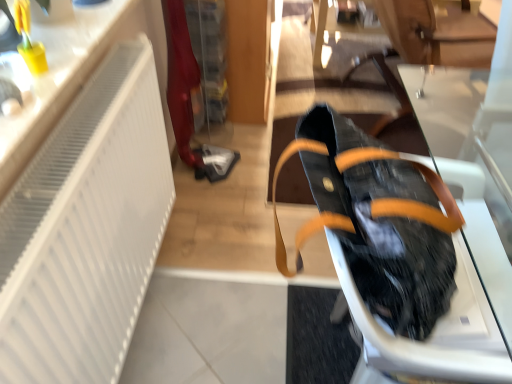
Question: Considering their positions, is black leather bag at right located in front of or behind white matte radiator at left?

Choices:
 (A) behind
 (B) front

Answer: (A)

Question: Would you say black leather bag at right is to the left or to the right of white matte radiator at left in the picture?

Choices:
 (A) right
 (B) left

Answer: (A)

Question: From their relative heights in the image, would you say black leather bag at right is taller or shorter than white matte radiator at left?

Choices:
 (A) tall
 (B) short

Answer: (B)

Question: Considering the positions of white matte radiator at left and black leather bag at right in the image, is white matte radiator at left wider or thinner than black leather bag at right?

Choices:
 (A) thin
 (B) wide

Answer: (A)

Question: From the image's perspective, relative to black leather bag at right, is white matte radiator at left above or below?

Choices:
 (A) above
 (B) below

Answer: (B)

Question: Considering the positions of white matte radiator at left and black leather bag at right in the image, is white matte radiator at left bigger or smaller than black leather bag at right?

Choices:
 (A) big
 (B) small

Answer: (A)

Question: From a real-world perspective, is white matte radiator at left physically located above or below black leather bag at right?

Choices:
 (A) below
 (B) above

Answer: (A)